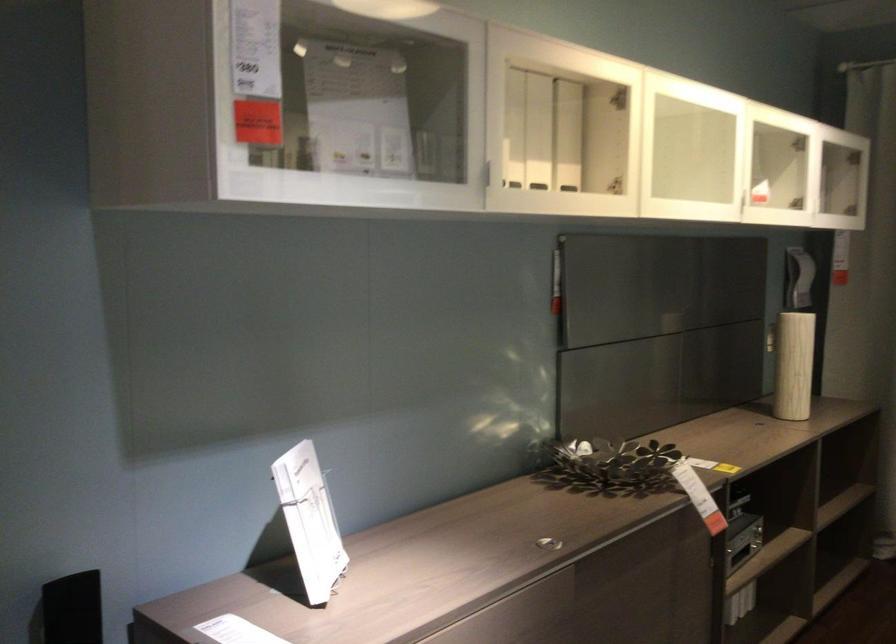
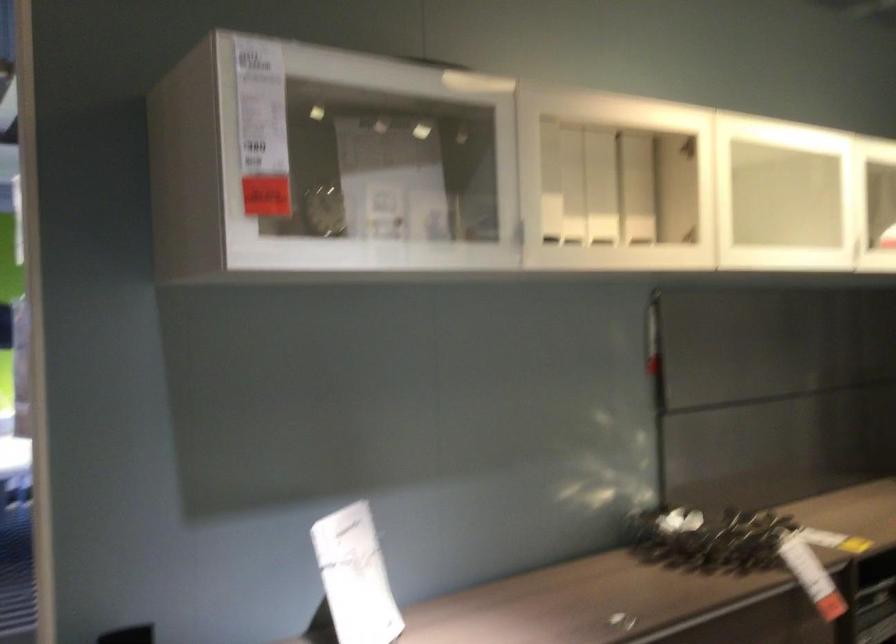
Locate, in the second image, the point that corresponds to (x=520, y=126) in the first image.

(573, 184)